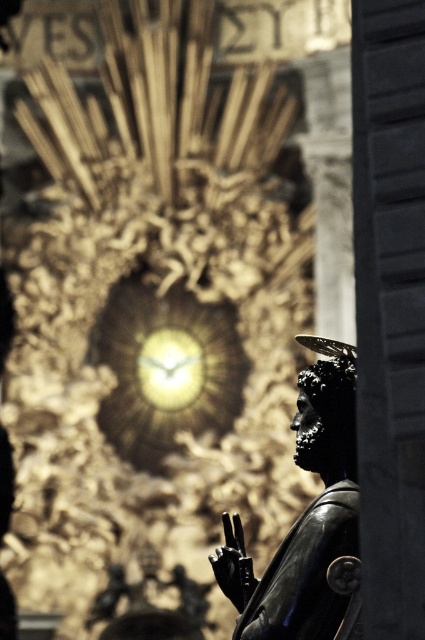
How distant is polished bronze statue at lower right from gold metallic clock at center?

polished bronze statue at lower right and gold metallic clock at center are 163.42 feet apart.

Does point (353, 412) lie behind point (127, 294)?

No, it is not.

This screenshot has width=425, height=640. I want to click on polished bronze statue at lower right, so click(305, 516).